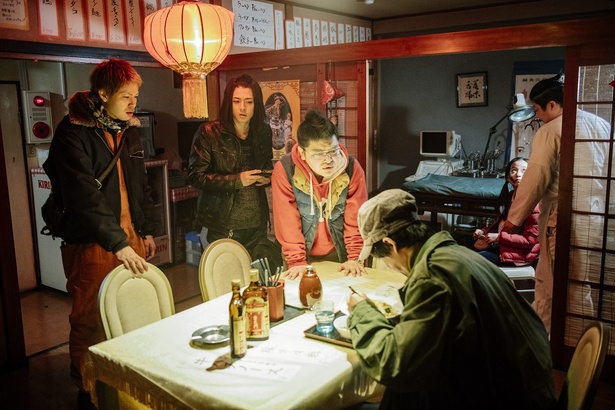
Locate an element on the screen. Image resolution: width=615 pixels, height=410 pixels. chairs is located at coordinates (113, 314), (221, 265), (589, 364).